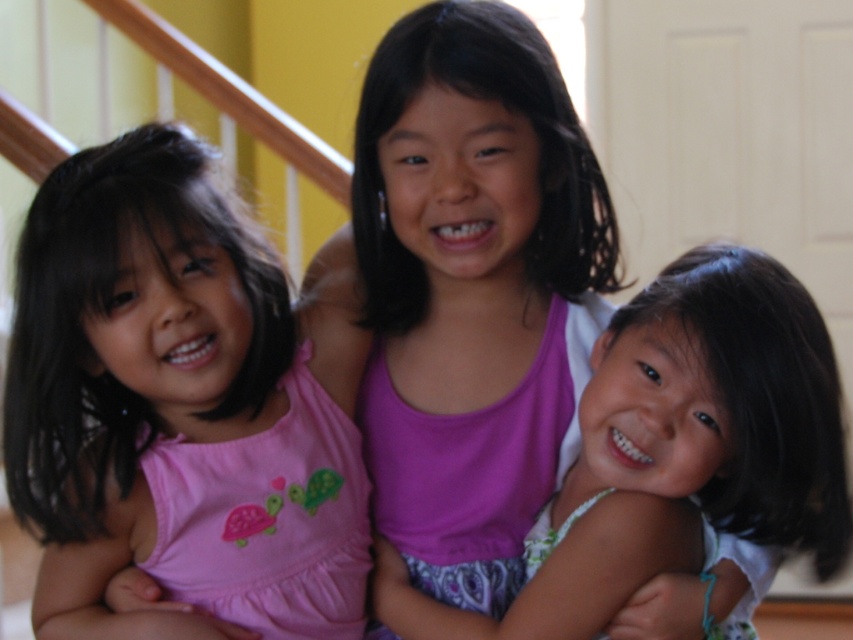
You are standing at the bottom of the staircase in the image and want to reach the door. There are two points marked in the image, point A at coordinates point (310, 589) and point B at coordinates point (792, 512). Which point should you pass through first to reach the door?

You should pass through point B at coordinates point (792, 512) first because point A at coordinates point (310, 589) is behind it, so you need to go through point B first before reaching point A.

You are a parent trying to choose between two pink dresses for your child. You see both the pink fabric dress at center and the matte pink dress at center in the image. Which one is bigger?

The pink fabric dress at center is larger in size compared to the matte pink dress at center.